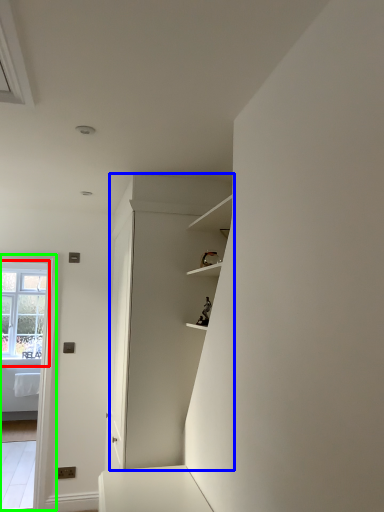
Question: Estimate the real-world distances between objects in this image. Which object is closer to window (highlighted by a red box), dresser (highlighted by a blue box) or glass door (highlighted by a green box)?

Choices:
 (A) dresser
 (B) glass door

Answer: (B)